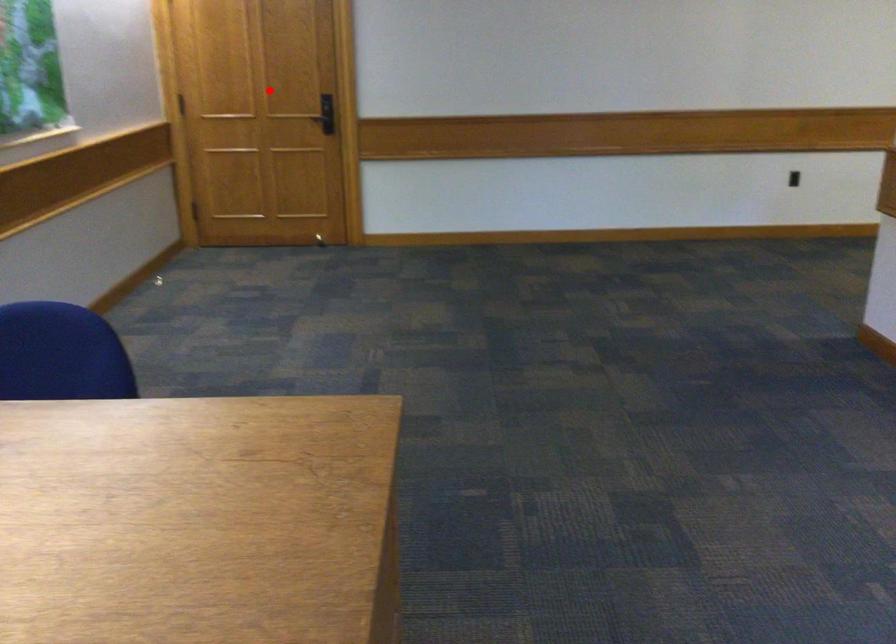
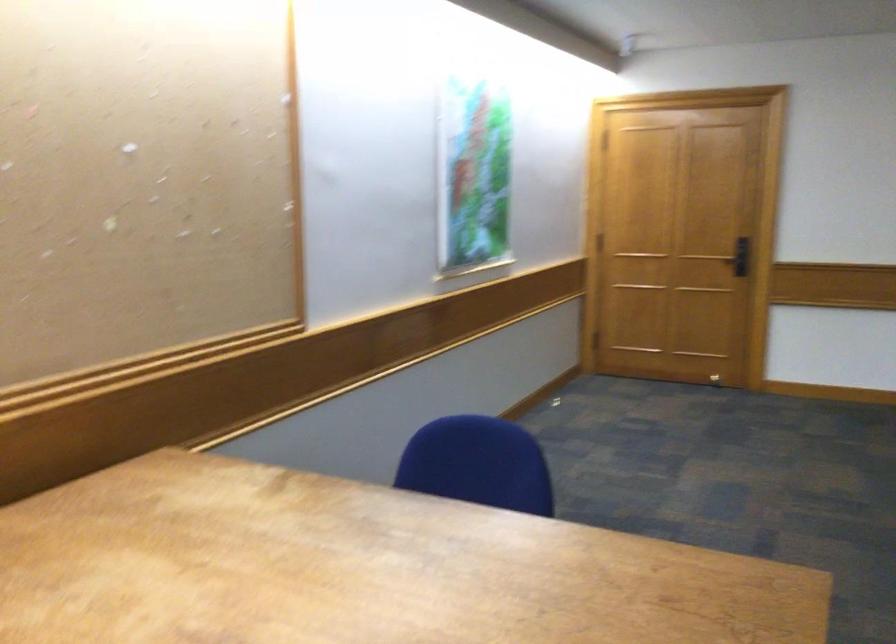
Where in the second image is the point corresponding to the highlighted location from the first image?

(681, 230)